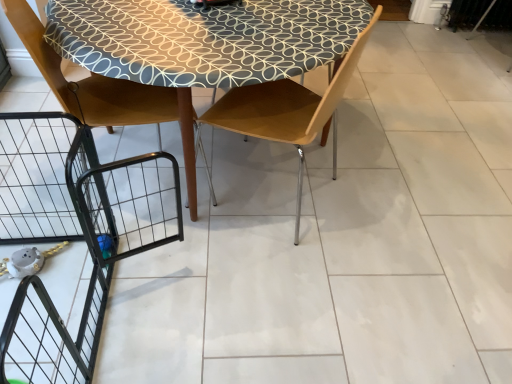
Image resolution: width=512 pixels, height=384 pixels. Find the location of `vacant space that is to the left of wooden chair at center, which ranks as the 2th chair in left-to-right order`. vacant space that is to the left of wooden chair at center, which ranks as the 2th chair in left-to-right order is located at coordinates (195, 197).